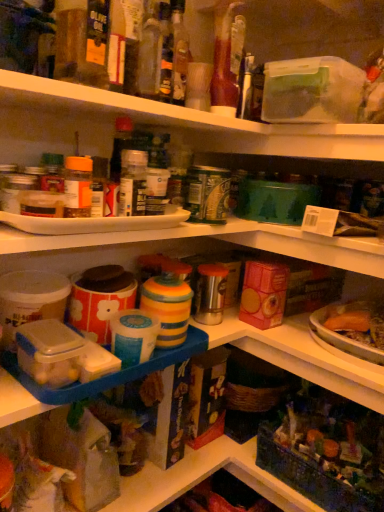
Question: Is translucent plastic container at lower right taller or shorter than translucent glass bottle at upper center, acting as the first bottle starting from the right?

Choices:
 (A) short
 (B) tall

Answer: (B)

Question: Is translucent plastic container at lower right inside the boundaries of translucent glass bottle at upper center, the fourth bottle in the left-to-right sequence, or outside?

Choices:
 (A) outside
 (B) inside

Answer: (A)

Question: Based on their relative distances, which object is nearer to the translucent glass bottle at upper center, acting as the first bottle starting from the right?

Choices:
 (A) translucent glass bottle at center, positioned as the 3th bottle in left-to-right order
 (B) translucent glass bottle at upper center, the second bottle from the left
 (C) translucent plastic container at lower right
 (D) matte plastic bottle at center, which is the 1th bottle in left-to-right order

Answer: (A)

Question: Estimate the real-world distances between objects in this image. Which object is closer to the translucent glass bottle at upper center, which is counted as the 3th bottle, starting from the right?

Choices:
 (A) translucent glass bottle at center, positioned as the 3th bottle in left-to-right order
 (B) translucent plastic container at lower right
 (C) matte plastic bottle at center, the 4th bottle in the right-to-left sequence
 (D) translucent glass bottle at upper center, the fourth bottle in the left-to-right sequence

Answer: (A)